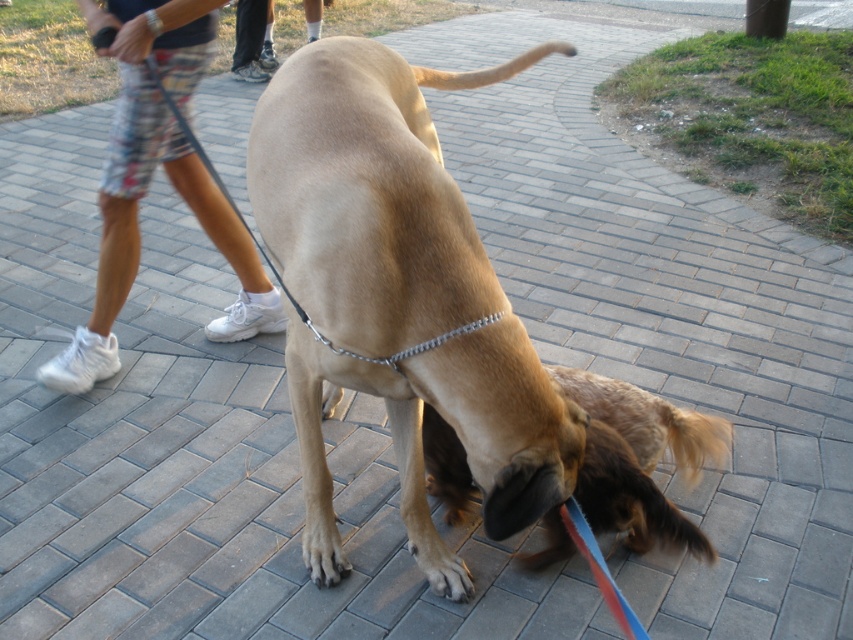
You are standing on the paved pathway and see the white fabric shorts at left and the brown fur dog at center. Which object is closer to you?

The white fabric shorts at left are closer to you because they are positioned over the brown fur dog at center, meaning they are in a more forward spatial position.

In the scene shown: You are a dog owner trying to decide if your dog can comfortably walk through a narrow gap between two objects. The gap is just wide enough to fit the brown fur paw at lower center. Can the white fabric shorts at left also fit through the same gap?

The white fabric shorts at left has a larger size compared to brown fur paw at lower center. Therefore, the gap that fits the brown fur paw at lower center may be too small for the white fabric shorts at left to pass through comfortably.

You are a dog trainer observing a dog on a paved path. You notice two paws at the lower center of the scene. The dog has a blue leash and is sniffing the ground. Can you determine if the distance between the brown matte paw at lower center and the brown fur paw at lower center is more than 10 inches?

The distance between the brown matte paw at lower center and the brown fur paw at lower center is 10.01 inches, which is just over 10 inches. Therefore, the distance is more than 10 inches.